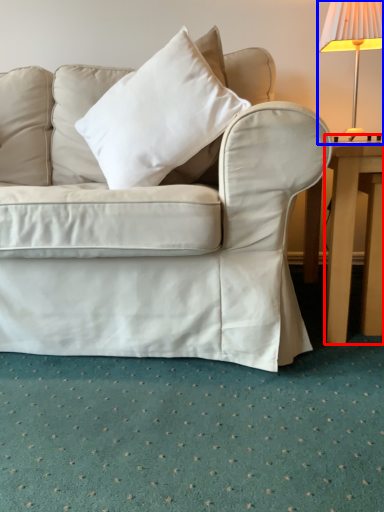
Question: Which object is closer to the camera taking this photo, table (highlighted by a red box) or lamp (highlighted by a blue box)?

Choices:
 (A) table
 (B) lamp

Answer: (A)